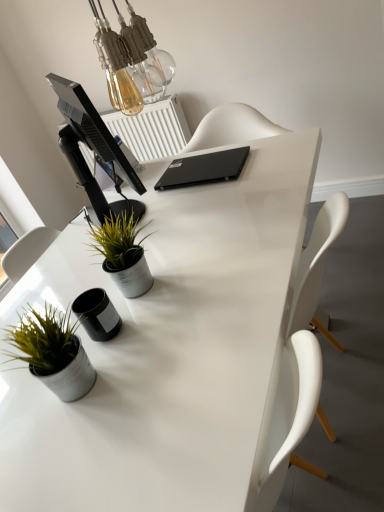
At what (x,y) coordinates should I click in order to perform the action: click on vacant area that is in front of metallic gray pot at center, which is counted as the second houseplant, starting from the bottom. Please return your answer as a coordinate pair (x, y). Looking at the image, I should click on (153, 317).